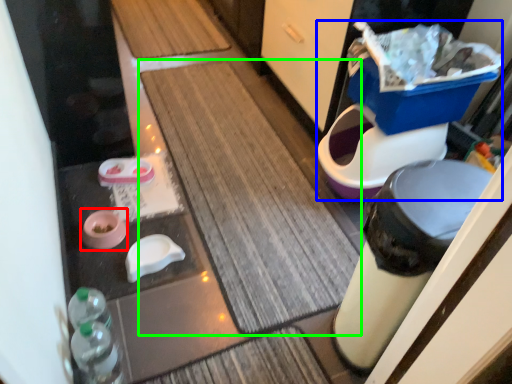
Question: Based on their relative distances, which object is farther from potty (highlighted by a red box)? Choose from potty (highlighted by a blue box) and bath mat (highlighted by a green box).

Choices:
 (A) potty
 (B) bath mat

Answer: (A)